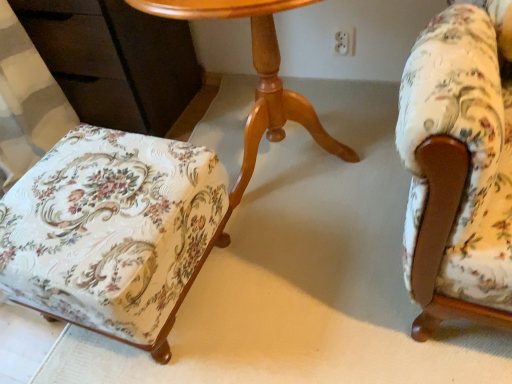
Question: From the image's perspective, is floral fabric armchair at right, acting as the 2th chair starting from the left, located above light brown wood table at center?

Choices:
 (A) no
 (B) yes

Answer: (A)

Question: Does floral fabric armchair at right, arranged as the first chair when viewed from the right, have a greater height compared to light brown wood table at center?

Choices:
 (A) no
 (B) yes

Answer: (B)

Question: Does floral fabric armchair at right, arranged as the first chair when viewed from the right, have a greater width compared to light brown wood table at center?

Choices:
 (A) no
 (B) yes

Answer: (B)

Question: Is floral fabric armchair at right, arranged as the first chair when viewed from the right, at the right side of light brown wood table at center?

Choices:
 (A) yes
 (B) no

Answer: (A)

Question: Can you confirm if floral fabric armchair at right, arranged as the first chair when viewed from the right, is positioned to the left of light brown wood table at center?

Choices:
 (A) yes
 (B) no

Answer: (B)

Question: From a real-world perspective, is floral fabric ottoman at lower left, the second chair in the right-to-left sequence, physically located above or below floral fabric armchair at right, acting as the 2th chair starting from the left?

Choices:
 (A) below
 (B) above

Answer: (A)

Question: Considering the positions of floral fabric ottoman at lower left, which is the 1th chair from left to right, and floral fabric armchair at right, acting as the 2th chair starting from the left, in the image, is floral fabric ottoman at lower left, which is the 1th chair from left to right, taller or shorter than floral fabric armchair at right, acting as the 2th chair starting from the left,?

Choices:
 (A) short
 (B) tall

Answer: (A)

Question: From the image's perspective, relative to floral fabric armchair at right, acting as the 2th chair starting from the left, is floral fabric ottoman at lower left, which is the 1th chair from left to right, above or below?

Choices:
 (A) below
 (B) above

Answer: (A)

Question: Is floral fabric ottoman at lower left, the second chair in the right-to-left sequence, wider or thinner than floral fabric armchair at right, arranged as the first chair when viewed from the right?

Choices:
 (A) wide
 (B) thin

Answer: (B)

Question: Is light brown wood table at center wider or thinner than floral fabric armchair at right, acting as the 2th chair starting from the left?

Choices:
 (A) wide
 (B) thin

Answer: (B)

Question: Would you say light brown wood table at center is inside or outside floral fabric armchair at right, acting as the 2th chair starting from the left?

Choices:
 (A) outside
 (B) inside

Answer: (A)

Question: Is light brown wood table at center bigger or smaller than floral fabric armchair at right, acting as the 2th chair starting from the left?

Choices:
 (A) small
 (B) big

Answer: (B)

Question: From a real-world perspective, is light brown wood table at center positioned above or below floral fabric armchair at right, acting as the 2th chair starting from the left?

Choices:
 (A) above
 (B) below

Answer: (B)

Question: Is point (243, 190) closer or farther from the camera than point (166, 226)?

Choices:
 (A) closer
 (B) farther

Answer: (B)

Question: Based on their sizes in the image, would you say light brown wood table at center is bigger or smaller than floral fabric ottoman at lower left, the second chair in the right-to-left sequence?

Choices:
 (A) small
 (B) big

Answer: (B)